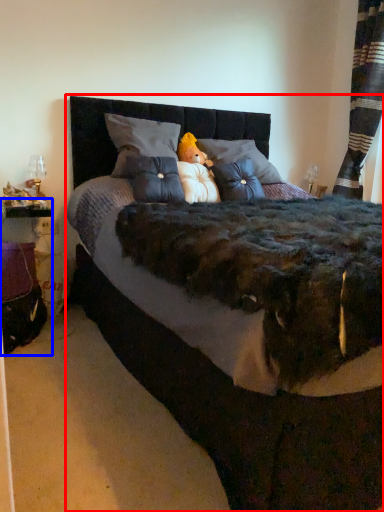
Question: Which object appears closest to the camera in this image, bed (highlighted by a red box) or table (highlighted by a blue box)?

Choices:
 (A) bed
 (B) table

Answer: (A)